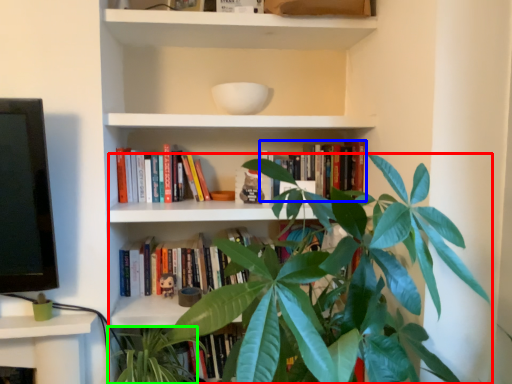
Question: Which object is the farthest from houseplant (highlighted by a red box)? Choose among these: book (highlighted by a blue box) or vegetation (highlighted by a green box).

Choices:
 (A) book
 (B) vegetation

Answer: (B)